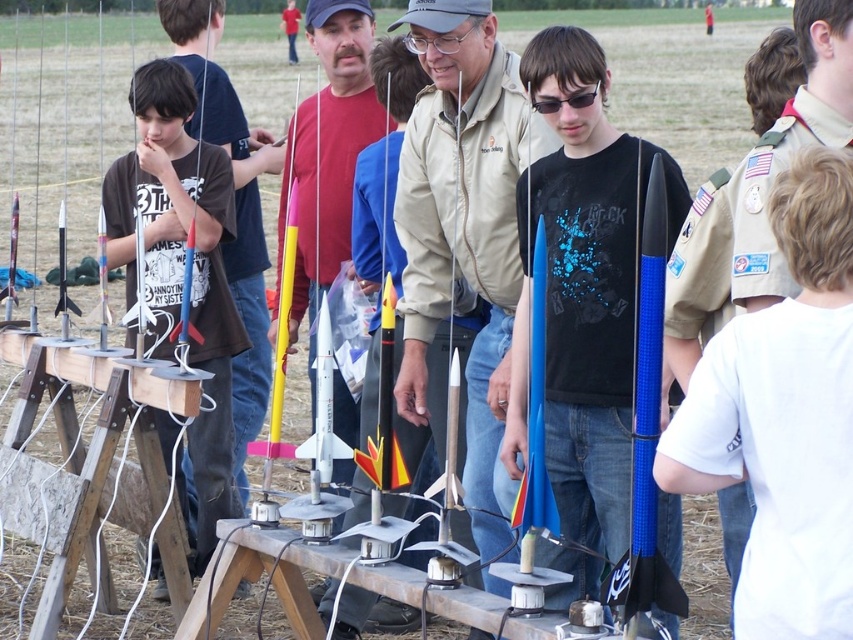
Does blue matte rocket at center have a greater width compared to blue textured pole at center?

Answer: Yes.

Who is positioned more to the right, blue matte rocket at center or blue textured pole at center?

Positioned to the right is blue textured pole at center.

Is point (616, 224) positioned before point (665, 634)?

No, (616, 224) is further to viewer.

This screenshot has width=853, height=640. Find the location of `blue matte rocket at center`. blue matte rocket at center is located at coordinates (583, 291).

Who is positioned more to the right, white cotton shirt at center or matte black t-shirt at left?

Positioned to the right is white cotton shirt at center.

Which is behind, point (833, 205) or point (189, 88)?

The point (189, 88) is more distant.

Locate an element on the screen. The width and height of the screenshot is (853, 640). white cotton shirt at center is located at coordinates (784, 417).

Can you confirm if matte black t-shirt at left is positioned to the left of black plastic goggles at center?

Indeed, matte black t-shirt at left is positioned on the left side of black plastic goggles at center.

Who is more forward, (132, 240) or (585, 90)?

Point (585, 90)

The height and width of the screenshot is (640, 853). Find the location of `matte black t-shirt at left`. matte black t-shirt at left is located at coordinates (181, 278).